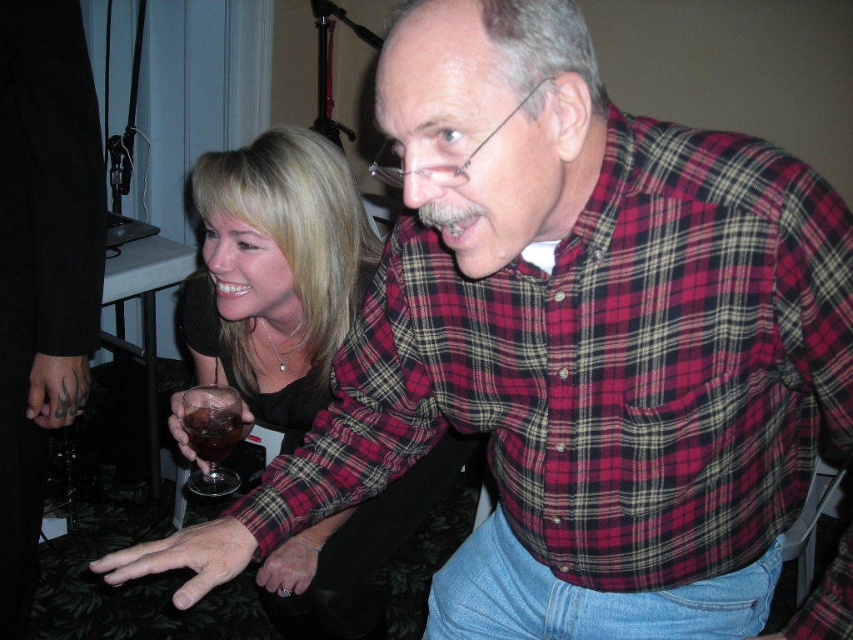
Is plaid cotton shirt at center behind translucent glass drink at center?

No, it is not.

At what (x,y) coordinates should I click in order to perform the action: click on plaid cotton shirt at center. Please return your answer as a coordinate pair (x, y). The height and width of the screenshot is (640, 853). Looking at the image, I should click on (608, 365).

Describe the element at coordinates (608, 365) in the screenshot. I see `plaid cotton shirt at center` at that location.

What are the coordinates of `plaid cotton shirt at center` in the screenshot? It's located at click(608, 365).

Does matte black dress at center have a greater height compared to translucent glass drink at center?

Yes, matte black dress at center is taller than translucent glass drink at center.

Is matte black dress at center behind translucent glass drink at center?

Yes.

Identify the location of matte black dress at center. (276, 273).

Where is `plaid cotton shirt at center`? This screenshot has width=853, height=640. plaid cotton shirt at center is located at coordinates (608, 365).

Who is lower down, plaid cotton shirt at center or translucent glass wine at lower left?

translucent glass wine at lower left is lower down.

Where is `plaid cotton shirt at center`? Image resolution: width=853 pixels, height=640 pixels. plaid cotton shirt at center is located at coordinates (608, 365).

Locate an element on the screen. This screenshot has height=640, width=853. plaid cotton shirt at center is located at coordinates (608, 365).